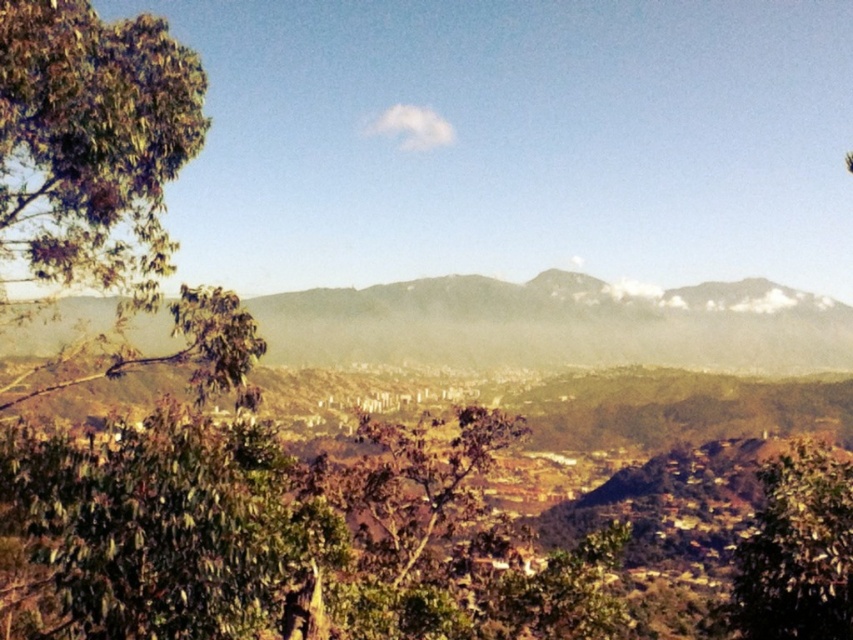
You are standing in the scenic mountain view and want to take a photo. You have a camera with a standard zoom lens that can capture objects up to 10 meters away. The green leafy tree at lower right is 5 meters away from you. Can you capture the green textured mountain at center in your photo with this lens?

The green textured mountain at center is above the green leafy tree at lower right, but distance isn

You are standing at the point labeled point (558, 324) in the image. Looking around, what is the most prominent feature directly in front of you?

The point labeled point (558, 324) corresponds to a green textured mountain at center, so the most prominent feature directly in front of you is the green textured mountain at center.